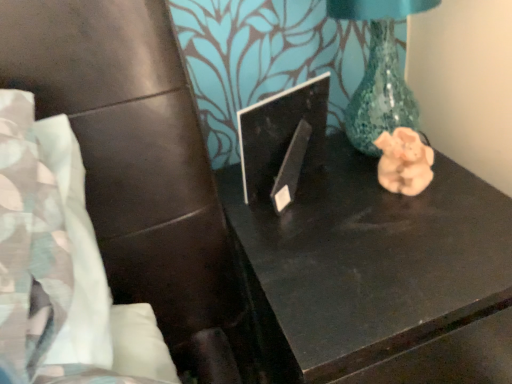
Question: Can you confirm if pink clay pig at right is smaller than black glossy table at center?

Choices:
 (A) no
 (B) yes

Answer: (B)

Question: Is black glossy table at center a part of pink clay pig at right?

Choices:
 (A) yes
 (B) no

Answer: (B)

Question: Is pink clay pig at right wider than black glossy table at center?

Choices:
 (A) yes
 (B) no

Answer: (B)

Question: Is pink clay pig at right shorter than black glossy table at center?

Choices:
 (A) no
 (B) yes

Answer: (B)

Question: Considering the relative positions of pink clay pig at right and black glossy table at center in the image provided, is pink clay pig at right to the left of black glossy table at center from the viewer's perspective?

Choices:
 (A) yes
 (B) no

Answer: (B)

Question: From the image's perspective, is black glossy laptop at center above or below pink clay pig at right?

Choices:
 (A) above
 (B) below

Answer: (A)

Question: In terms of size, does black glossy laptop at center appear bigger or smaller than pink clay pig at right?

Choices:
 (A) big
 (B) small

Answer: (A)

Question: From their relative heights in the image, would you say black glossy laptop at center is taller or shorter than pink clay pig at right?

Choices:
 (A) tall
 (B) short

Answer: (A)

Question: Is black glossy laptop at center in front of or behind pink clay pig at right in the image?

Choices:
 (A) front
 (B) behind

Answer: (A)

Question: From the image's perspective, is pink clay pig at right positioned above or below black glossy table at center?

Choices:
 (A) above
 (B) below

Answer: (A)

Question: Looking at their shapes, would you say pink clay pig at right is wider or thinner than black glossy table at center?

Choices:
 (A) wide
 (B) thin

Answer: (B)

Question: Considering the positions of pink clay pig at right and black glossy table at center in the image, is pink clay pig at right taller or shorter than black glossy table at center?

Choices:
 (A) short
 (B) tall

Answer: (A)

Question: Would you say pink clay pig at right is inside or outside black glossy table at center?

Choices:
 (A) outside
 (B) inside

Answer: (A)

Question: From the image's perspective, is black glossy laptop at center positioned above or below black glossy table at center?

Choices:
 (A) below
 (B) above

Answer: (B)

Question: Is black glossy laptop at center bigger or smaller than black glossy table at center?

Choices:
 (A) small
 (B) big

Answer: (A)